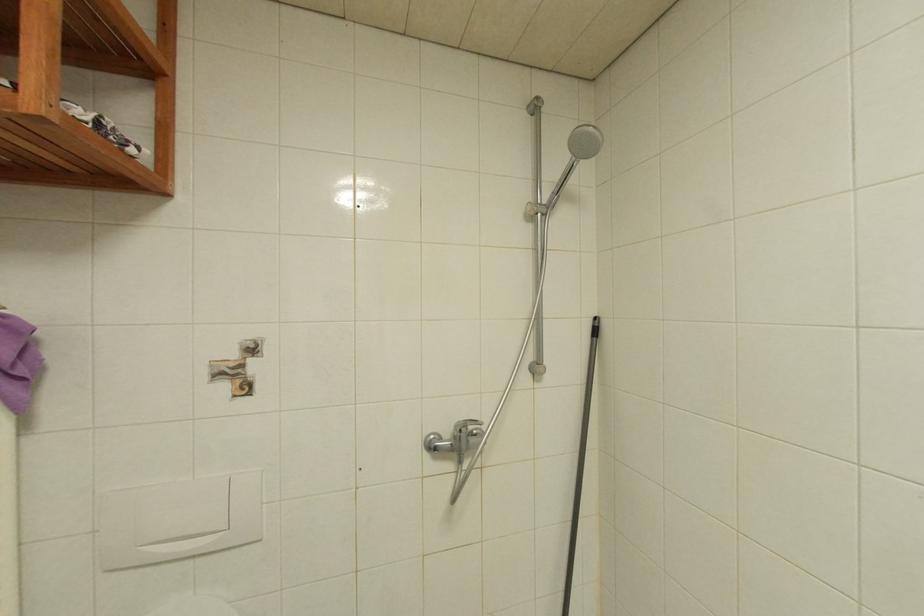
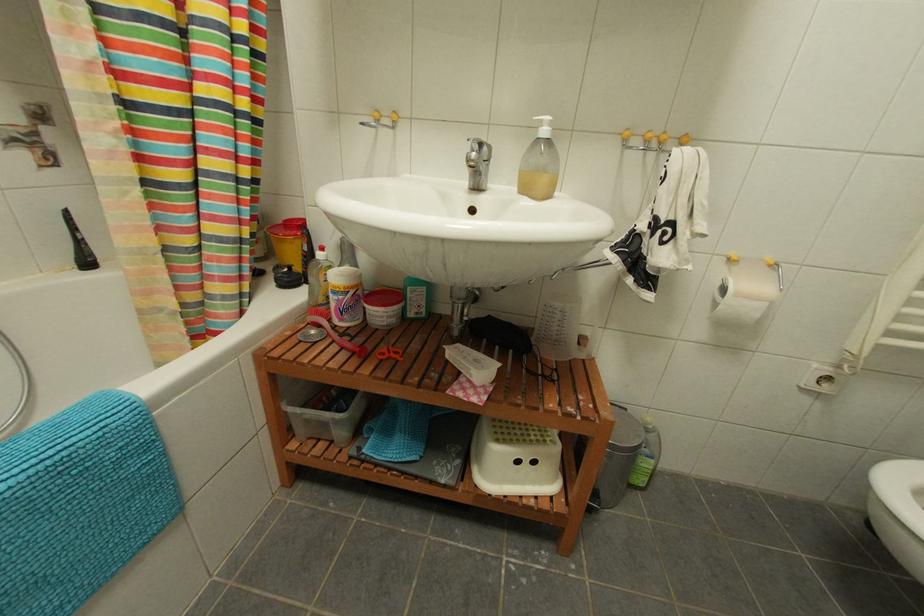
First-person continuous shooting, in which direction is the camera rotating?

The camera's rotation is toward left-down.